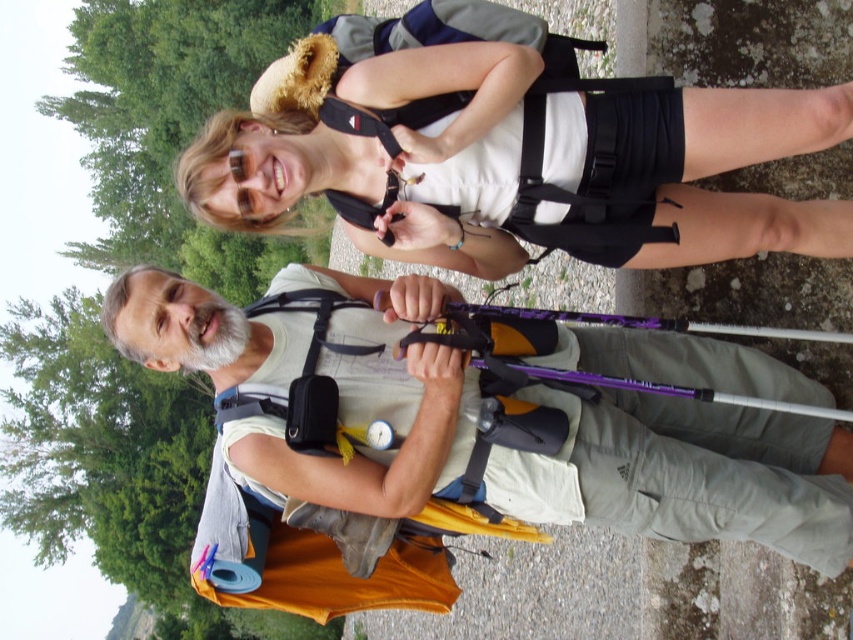
Question: Can you confirm if matte black backpack at upper center is positioned to the right of purple glossy ski pole at center?

Choices:
 (A) yes
 (B) no

Answer: (B)

Question: Where is matte gray shirt at center located in relation to matte black backpack at upper center in the image?

Choices:
 (A) left
 (B) right

Answer: (A)

Question: Which of the following is the farthest from the observer?

Choices:
 (A) purple glossy ski pole at center
 (B) matte gray shirt at center
 (C) matte black backpack at upper center

Answer: (A)

Question: Does matte gray shirt at center have a smaller size compared to matte black backpack at upper center?

Choices:
 (A) no
 (B) yes

Answer: (A)

Question: Which point is closer to the camera?

Choices:
 (A) (753, 465)
 (B) (207, 200)
 (C) (637, 323)

Answer: (C)

Question: Which point is closer to the camera?

Choices:
 (A) (251, 432)
 (B) (630, 164)
 (C) (669, 324)

Answer: (C)